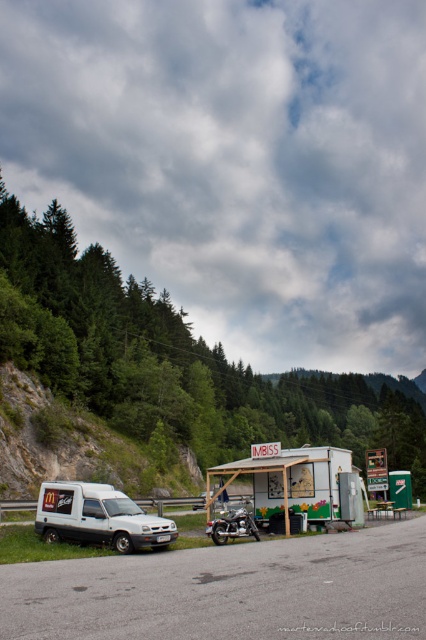
You are a delivery driver who needs to park your truck, which is 2 meters tall, near the white matte van at lower left. Can you safely park your truck next to the green painted wood food stall at center without hitting the roof?

The green painted wood food stall at center is taller than the white matte van at lower left. Since the truck is 2 meters tall and the food stall is taller than the van, it is possible that the stall might be taller than 2 meters. Therefore, parking the truck next to the stall could risk hitting the roof if the stall exceeds the truck height. Check the actual height before parking.

You are a tourist who just arrived at this mountainous area and want to find the white matte van at lower left. From the green painted wood food stall at center, which direction should you go to reach the van?

The white matte van at lower left is to the left of the green painted wood food stall at center, so you should go left to reach it.

You are a delivery person who needs to load a large package onto your truck. The truck is parked behind the shiny chrome motorcycle at center. Can you drive forward to get closer to the green painted wood food stall at center without hitting the motorcycle?

The green painted wood food stall at center is much taller than the shiny chrome motorcycle at center, so driving forward would not hit the motorcycle as the stall is taller. However, you need to ensure there is enough space between the motorcycle and the stall to maneuver safely.